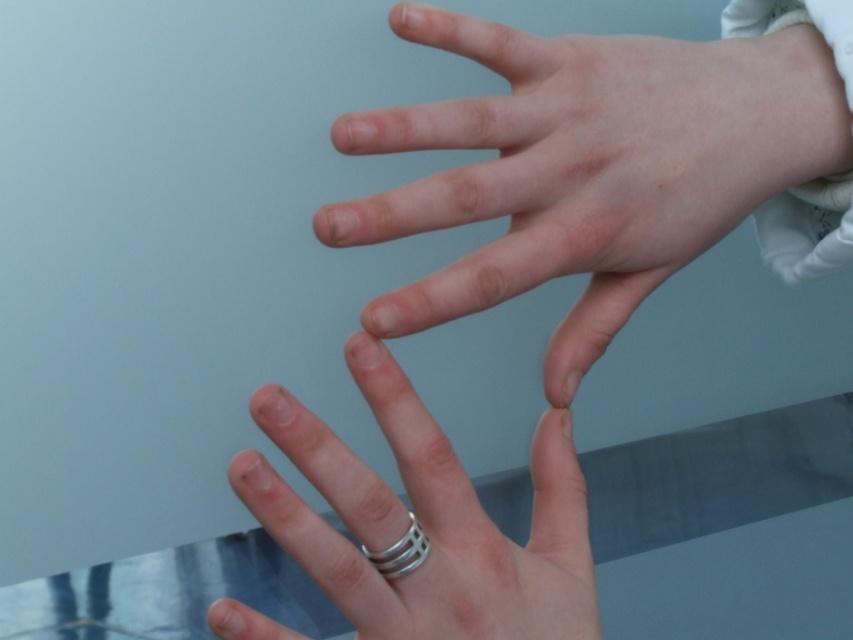
Consider the image. Does transparent glass table at lower center have a larger size compared to silver metallic ring at lower center?

Indeed, transparent glass table at lower center has a larger size compared to silver metallic ring at lower center.

Does point (680, 493) come farther from viewer compared to point (397, 547)?

Yes, point (680, 493) is behind point (397, 547).

Locate an element on the screen. transparent glass table at lower center is located at coordinates (717, 476).

Who is positioned more to the right, silver metallic ring at center or transparent glass table at lower center?

transparent glass table at lower center is more to the right.

Which is more to the left, silver metallic ring at center or transparent glass table at lower center?

silver metallic ring at center

What do you see at coordinates (444, 531) in the screenshot?
I see `silver metallic ring at center` at bounding box center [444, 531].

Identify the location of silver metallic ring at center. This screenshot has width=853, height=640. (444, 531).

Is pale skin hand at center in front of silver metallic ring at center?

That is False.

Who is more distant from viewer, (413,291) or (412,611)?

Positioned behind is point (413,291).

Where is `pale skin hand at center`? This screenshot has width=853, height=640. pale skin hand at center is located at coordinates (589, 166).